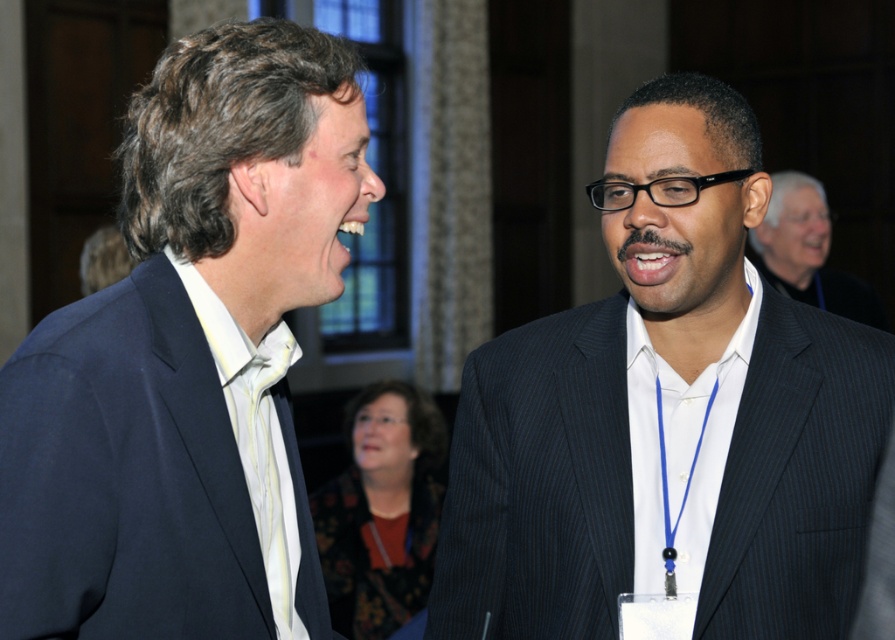
Locate an element on the screen. The height and width of the screenshot is (640, 895). dark pinstripe suit at center is located at coordinates (595, 381).

Is dark pinstripe suit at center closer to the viewer compared to black pinstripe suit at center?

Yes, dark pinstripe suit at center is closer to the viewer.

The width and height of the screenshot is (895, 640). Describe the element at coordinates (595, 381) in the screenshot. I see `dark pinstripe suit at center` at that location.

Image resolution: width=895 pixels, height=640 pixels. What are the coordinates of `dark pinstripe suit at center` in the screenshot? It's located at (595, 381).

Which is in front, point (275, 378) or point (854, 288)?

Positioned in front is point (275, 378).

Does yellow striped tie at left have a smaller size compared to black pinstripe suit at center?

Indeed, yellow striped tie at left has a smaller size compared to black pinstripe suit at center.

Which is in front, point (246, 444) or point (800, 234)?

Point (246, 444)

At what (x,y) coordinates should I click in order to perform the action: click on yellow striped tie at left. Please return your answer as a coordinate pair (x, y). This screenshot has width=895, height=640. Looking at the image, I should click on (268, 470).

Who is taller, dark pinstripe suit at center or yellow striped tie at left?

Standing taller between the two is dark pinstripe suit at center.

Which is below, dark pinstripe suit at center or yellow striped tie at left?

yellow striped tie at left is below.

What do you see at coordinates (595, 381) in the screenshot? I see `dark pinstripe suit at center` at bounding box center [595, 381].

Locate an element on the screen. dark pinstripe suit at center is located at coordinates (595, 381).